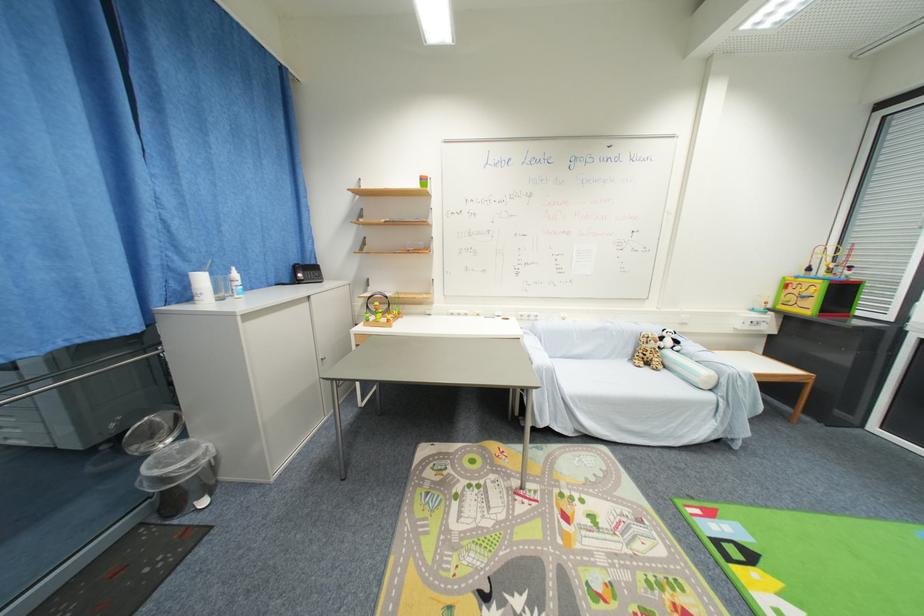
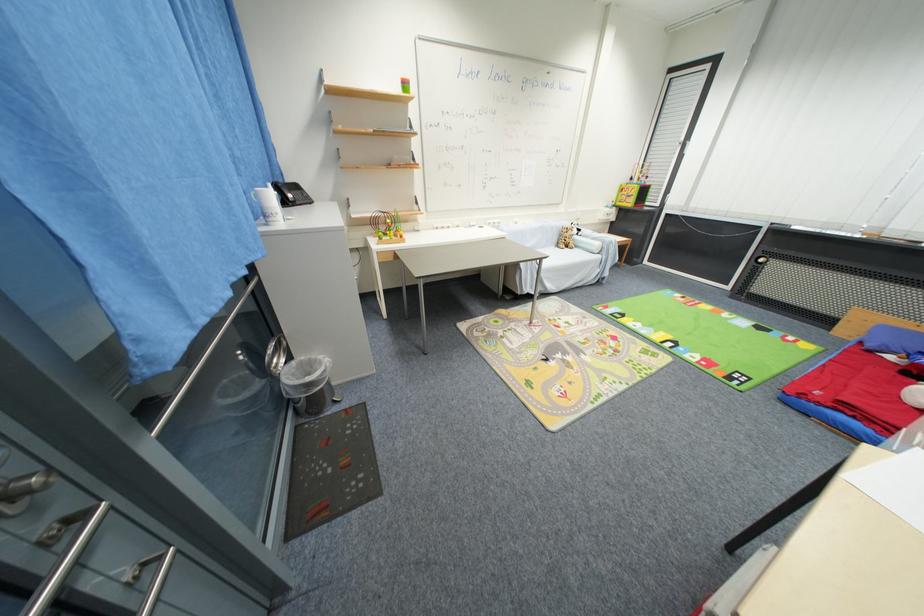
Where in the second image is the point corresponding to pixel 305 277 from the first image?

(296, 198)